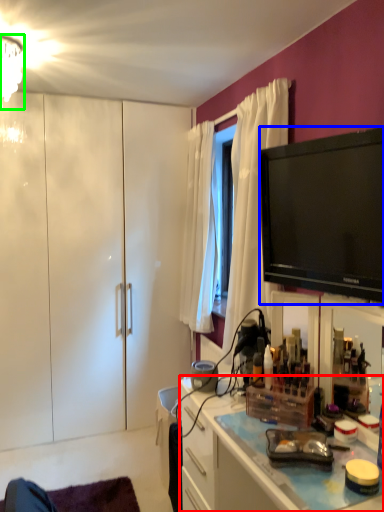
Question: Estimate the real-world distances between objects in this image. Which object is farther from cabinetry (highlighted by a red box), television (highlighted by a blue box) or lamp (highlighted by a green box)?

Choices:
 (A) television
 (B) lamp

Answer: (B)